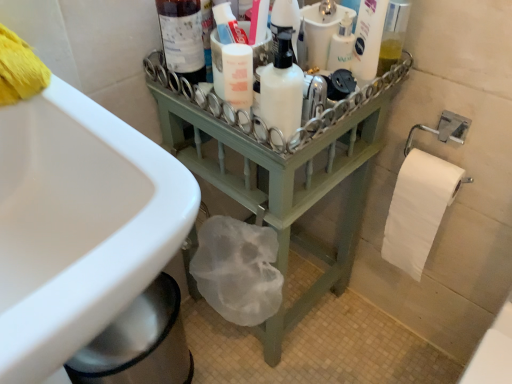
What are the coordinates of `translucent plastic bottle at upper center, marked as the 2th cleaning product in a left-to-right arrangement` in the screenshot? It's located at (321, 32).

Image resolution: width=512 pixels, height=384 pixels. Describe the element at coordinates (341, 45) in the screenshot. I see `white glossy mouthwash at center` at that location.

This screenshot has height=384, width=512. Describe the element at coordinates (368, 39) in the screenshot. I see `white glossy lotion at upper right, which is the 1th cleaning product in right-to-left order` at that location.

I want to click on white matte bottle at center, marked as the 3th cleaning product in a right-to-left arrangement, so click(281, 91).

The width and height of the screenshot is (512, 384). In order to click on mouthwash that appears below the white glossy lotion at upper right, which is the 1th cleaning product in right-to-left order (from the image's perspective) in this screenshot , I will do `click(341, 45)`.

In the scene shown: Is the position of white glossy lotion at upper right, the 3th cleaning product in the left-to-right sequence, more distant than that of white glossy mouthwash at center?

No, white glossy lotion at upper right, the 3th cleaning product in the left-to-right sequence, is closer to the camera.

Is white glossy lotion at upper right, the 3th cleaning product in the left-to-right sequence, not within white glossy mouthwash at center?

Yes, white glossy lotion at upper right, the 3th cleaning product in the left-to-right sequence, is outside of white glossy mouthwash at center.

How different are the orientations of white glossy lotion at upper right, which is the 1th cleaning product in right-to-left order, and white glossy mouthwash at center in degrees?

They differ by 36.8 degrees in their facing directions.

Considering the relative sizes of green painted wood at center and white glossy mouthwash at center in the image provided, is green painted wood at center smaller than white glossy mouthwash at center?

Incorrect, green painted wood at center is not smaller in size than white glossy mouthwash at center.

Does green painted wood at center appear on the right side of white glossy mouthwash at center?

Incorrect, green painted wood at center is not on the right side of white glossy mouthwash at center.

The width and height of the screenshot is (512, 384). In order to click on mouthwash located above the green painted wood at center (from a real-world perspective) in this screenshot , I will do click(x=341, y=45).

Is point (283, 115) less distant than point (181, 6)?

Yes.

From a real-world perspective, between white matte bottle at center, which appears as the first cleaning product when viewed from the left, and matte glass bottle at upper center, who is vertically lower?

In real-world perspective, white matte bottle at center, which appears as the first cleaning product when viewed from the left, is lower.

Which object is closer to the camera taking this photo, white matte bottle at center, marked as the 3th cleaning product in a right-to-left arrangement, or matte glass bottle at upper center?

white matte bottle at center, marked as the 3th cleaning product in a right-to-left arrangement, is in front.

Can you confirm if white glossy mouthwash at center is shorter than white matte bottle at center, marked as the 3th cleaning product in a right-to-left arrangement?

Yes.

From the picture: From a real-world perspective, who is located lower, white glossy mouthwash at center or white matte bottle at center, marked as the 3th cleaning product in a right-to-left arrangement?

white glossy mouthwash at center.

Are white glossy mouthwash at center and white matte bottle at center, marked as the 3th cleaning product in a right-to-left arrangement, located far from each other?

No, white glossy mouthwash at center is not far from white matte bottle at center, marked as the 3th cleaning product in a right-to-left arrangement.

The height and width of the screenshot is (384, 512). Identify the location of cleaning product below the white glossy mouthwash at center (from the image's perspective). (281, 91).

Does point (370, 49) come farther from viewer compared to point (304, 25)?

No, it is not.

Between white glossy lotion at upper right, the 3th cleaning product in the left-to-right sequence, and translucent plastic bottle at upper center, acting as the 2th cleaning product starting from the right, which one has larger size?

With larger size is translucent plastic bottle at upper center, acting as the 2th cleaning product starting from the right.

Which object is positioned more to the right, white glossy lotion at upper right, which is the 1th cleaning product in right-to-left order, or translucent plastic bottle at upper center, acting as the 2th cleaning product starting from the right?

white glossy lotion at upper right, which is the 1th cleaning product in right-to-left order.

Which point is more distant from viewer, (327, 69) or (334, 19)?

The point (327, 69) is behind.

From a real-world perspective, who is located higher, white glossy mouthwash at center or translucent plastic bottle at upper center, acting as the 2th cleaning product starting from the right?

From a 3D spatial view, translucent plastic bottle at upper center, acting as the 2th cleaning product starting from the right, is above.

Is white glossy mouthwash at center beside translucent plastic bottle at upper center, marked as the 2th cleaning product in a left-to-right arrangement?

Yes.

Between white glossy mouthwash at center and translucent plastic bottle at upper center, marked as the 2th cleaning product in a left-to-right arrangement, which one appears on the right side from the viewer's perspective?

From the viewer's perspective, white glossy mouthwash at center appears more on the right side.

Is translucent plastic bottle at upper center, marked as the 2th cleaning product in a left-to-right arrangement, wider than white glossy mouthwash at center?

Yes, translucent plastic bottle at upper center, marked as the 2th cleaning product in a left-to-right arrangement, is wider than white glossy mouthwash at center.

Which is more to the right, translucent plastic bottle at upper center, marked as the 2th cleaning product in a left-to-right arrangement, or white glossy mouthwash at center?

Positioned to the right is white glossy mouthwash at center.

Which point is more forward, [325,42] or [339,61]?

The point [325,42] is more forward.

Is translucent plastic bottle at upper center, marked as the 2th cleaning product in a left-to-right arrangement, bigger or smaller than white glossy mouthwash at center?

Clearly, translucent plastic bottle at upper center, marked as the 2th cleaning product in a left-to-right arrangement, is larger in size than white glossy mouthwash at center.

You are a GUI agent. You are given a task and a screenshot of the screen. Output one action in this format:
    pyautogui.click(x=<x>, y=<y>)
    Task: Click on the mouthwash that appears below the white glossy lotion at upper right, which is the 1th cleaning product in right-to-left order (from a real-world perspective)
    This screenshot has width=512, height=384.
    Given the screenshot: What is the action you would take?
    pyautogui.click(x=341, y=45)

You are a GUI agent. You are given a task and a screenshot of the screen. Output one action in this format:
    pyautogui.click(x=<x>, y=<y>)
    Task: Click on the mouthwash that is above the green painted wood at center (from a real-world perspective)
    The image size is (512, 384).
    Given the screenshot: What is the action you would take?
    pyautogui.click(x=341, y=45)

In the scene shown: Looking at the image, which one is located closer to matte glass bottle at upper center, white glossy lotion at upper right, the 3th cleaning product in the left-to-right sequence, or white glossy sink at lower left?

white glossy lotion at upper right, the 3th cleaning product in the left-to-right sequence, is positioned closer to the anchor matte glass bottle at upper center.

Considering their positions, is white glossy lotion at upper right, which is the 1th cleaning product in right-to-left order, positioned closer to white glossy mouthwash at center than white matte bottle at center, which appears as the first cleaning product when viewed from the left?

white glossy lotion at upper right, which is the 1th cleaning product in right-to-left order, lies closer to white glossy mouthwash at center than the other object.

When comparing their distances from white matte bottle at center, which appears as the first cleaning product when viewed from the left, does white glossy mouthwash at center or white glossy lotion at upper right, which is the 1th cleaning product in right-to-left order, seem further?

white glossy lotion at upper right, which is the 1th cleaning product in right-to-left order, lies further to white matte bottle at center, which appears as the first cleaning product when viewed from the left, than the other object.

Based on their spatial positions, is translucent plastic bottle at upper center, acting as the 2th cleaning product starting from the right, or white matte bottle at center, marked as the 3th cleaning product in a right-to-left arrangement, further from matte glass bottle at upper center?

Among the two, translucent plastic bottle at upper center, acting as the 2th cleaning product starting from the right, is located further to matte glass bottle at upper center.

From the picture: Looking at the image, which one is located closer to white glossy mouthwash at center, matte glass bottle at upper center or white glossy lotion at upper right, the 3th cleaning product in the left-to-right sequence?

white glossy lotion at upper right, the 3th cleaning product in the left-to-right sequence, lies closer to white glossy mouthwash at center than the other object.

Consider the image. Which object lies further to the anchor point translucent plastic bottle at upper center, acting as the 2th cleaning product starting from the right, white glossy mouthwash at center or matte glass bottle at upper center?

matte glass bottle at upper center lies further to translucent plastic bottle at upper center, acting as the 2th cleaning product starting from the right, than the other object.

When comparing their distances from matte glass bottle at upper center, does translucent plastic bottle at upper center, marked as the 2th cleaning product in a left-to-right arrangement, or white glossy mouthwash at center seem further?

white glossy mouthwash at center is positioned further to the anchor matte glass bottle at upper center.

From the image, which object appears to be nearer to white glossy mouthwash at center, white glossy lotion at upper right, the 3th cleaning product in the left-to-right sequence, or green painted wood at center?

white glossy lotion at upper right, the 3th cleaning product in the left-to-right sequence, lies closer to white glossy mouthwash at center than the other object.

Where is `balustrade between white glossy lotion at upper right, the 3th cleaning product in the left-to-right sequence, and white glossy sink at lower left vertically`? balustrade between white glossy lotion at upper right, the 3th cleaning product in the left-to-right sequence, and white glossy sink at lower left vertically is located at coordinates (282, 169).

Locate an element on the screen. The width and height of the screenshot is (512, 384). cleaning product that lies between white glossy lotion at upper right, which is the 1th cleaning product in right-to-left order, and white glossy sink at lower left from top to bottom is located at coordinates (281, 91).

I want to click on mouthwash that lies between matte glass bottle at upper center and green painted wood at center from top to bottom, so click(x=341, y=45).

Find the location of a particular element. cleaning product located between matte glass bottle at upper center and translucent plastic bottle at upper center, marked as the 2th cleaning product in a left-to-right arrangement, in the left-right direction is located at coordinates coord(281,91).